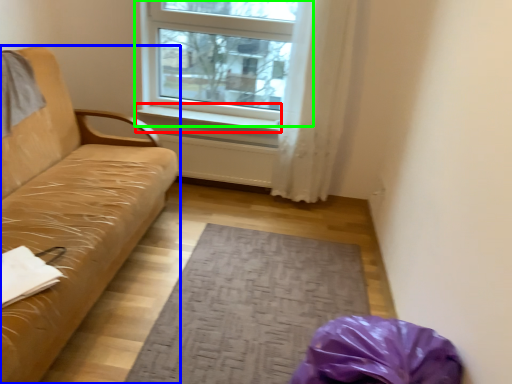
Question: Estimate the real-world distances between objects in this image. Which object is closer to window sill (highlighted by a red box), studio couch (highlighted by a blue box) or window (highlighted by a green box)?

Choices:
 (A) studio couch
 (B) window

Answer: (B)